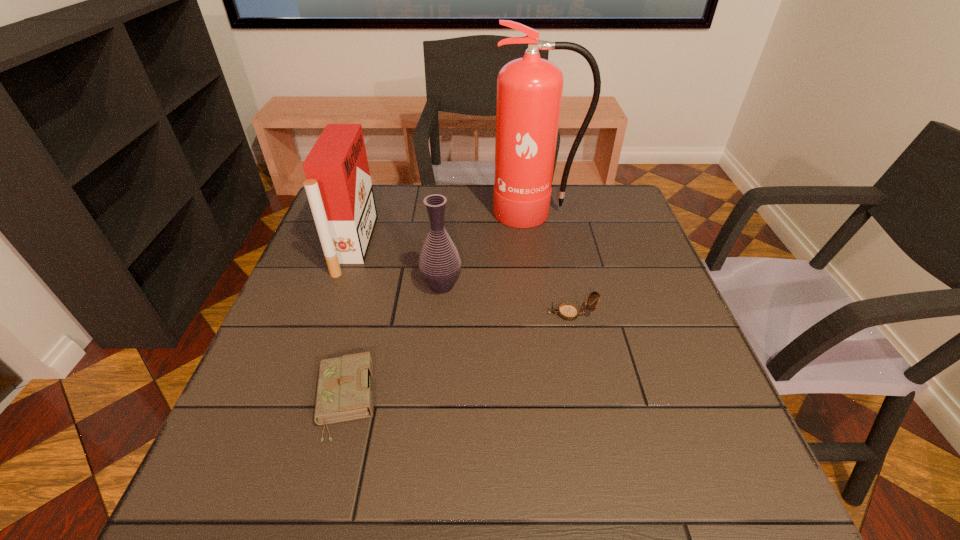
The width and height of the screenshot is (960, 540). In order to click on vacant space situated 0.160m on the left of the third tallest object in this screenshot , I will do `click(356, 286)`.

The image size is (960, 540). Identify the location of free space located on the face of the compass. (479, 314).

Where is `vacant space located on the face of the compass`? This screenshot has height=540, width=960. vacant space located on the face of the compass is located at coordinates (466, 314).

This screenshot has width=960, height=540. I want to click on vacant space located on the face of the compass, so click(x=479, y=314).

Where is `vacant area situated on the back of the shortest object`? Image resolution: width=960 pixels, height=540 pixels. vacant area situated on the back of the shortest object is located at coordinates (373, 290).

Identify the location of fire extinguisher that is at the far edge. (529, 90).

Where is `cigarette case positioned at the far edge`? cigarette case positioned at the far edge is located at coordinates (339, 189).

Image resolution: width=960 pixels, height=540 pixels. Identify the location of cigarette case that is at the left edge. [x=339, y=189].

You are a GUI agent. You are given a task and a screenshot of the screen. Output one action in this format:
    pyautogui.click(x=<x>, y=<y>)
    Task: Click on the diary present at the left edge
    The width and height of the screenshot is (960, 540).
    Given the screenshot: What is the action you would take?
    pyautogui.click(x=343, y=394)

You are a GUI agent. You are given a task and a screenshot of the screen. Output one action in this format:
    pyautogui.click(x=<x>, y=<y>)
    Task: Click on the object positioned at the far left corner
    Image resolution: width=960 pixels, height=540 pixels.
    Given the screenshot: What is the action you would take?
    pyautogui.click(x=339, y=189)